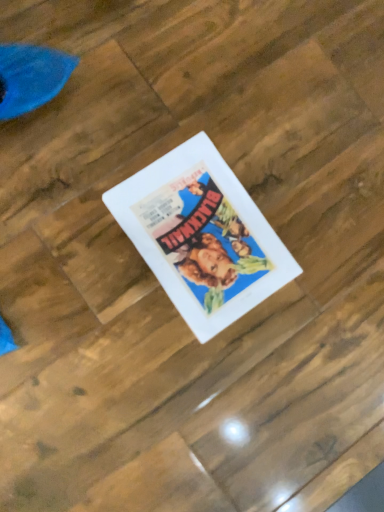
You are a GUI agent. You are given a task and a screenshot of the screen. Output one action in this format:
    pyautogui.click(x=<x>, y=<y>)
    Task: Click on the free space to the back side of white paper at center
    This screenshot has width=384, height=512.
    Given the screenshot: What is the action you would take?
    pyautogui.click(x=277, y=132)